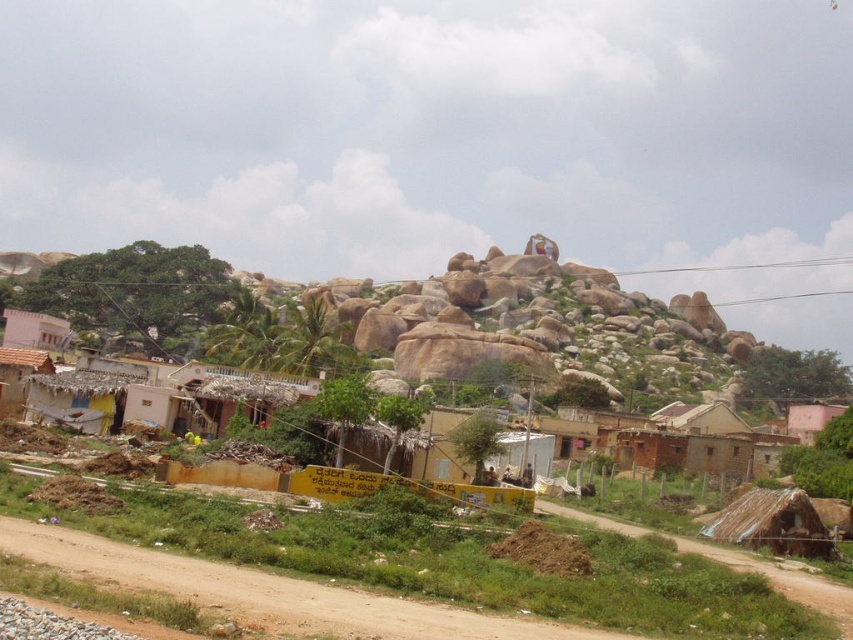
You are standing at the lower left corner of the image. You see the brown dirt track at lower left and the light pink painted wall at lower left. Which one is closer to the ground?

The brown dirt track at lower left is not as tall as the light pink painted wall at lower left, so the dirt track is closer to the ground.

You are standing at the point marked as point (15, 336) and want to walk towards the point marked as point (4, 545). Which direction should you face to move towards it?

You should face towards the direction of point (4, 545), which is closer to the camera than point (15, 336), so you need to walk towards the direction where point (4, 545) is located.